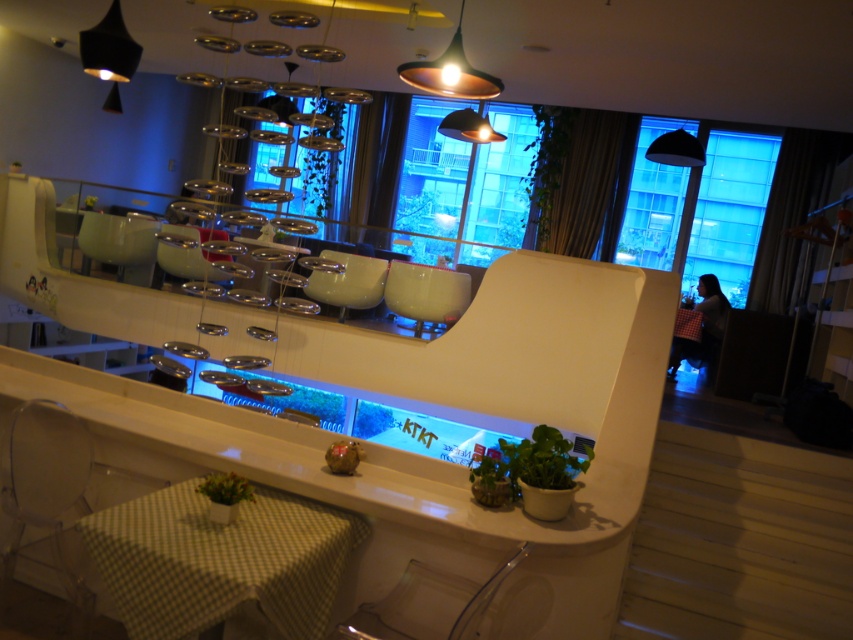
You are a customer entering the modern cafe and want to find a seat. You see the green checkered tablecloth at lower left and the green leafy plant at center. Which object is taller?

The green leafy plant at center is taller than the green checkered tablecloth at lower left.

You are standing in the modern cafe shown in the image. You want to take a photo of the point at coordinates point (x=91, y=516). Your camera has a maximum focus range of 2 meters. Can you capture the point clearly without moving closer?

The point (x=91, y=516) is 2.37 meters away from the camera, which exceeds the maximum focus range of 2 meters. Therefore, you cannot capture the point clearly without moving closer.

You are a customer at the modern cafe and want to place your phone on the counter. You notice the black matte lampshade at upper right and the green matte plant at lower center. Which object is wider so that your phone can fit better?

The black matte lampshade at upper right might be wider than the green matte plant at lower center, so placing the phone there could provide a better fit.